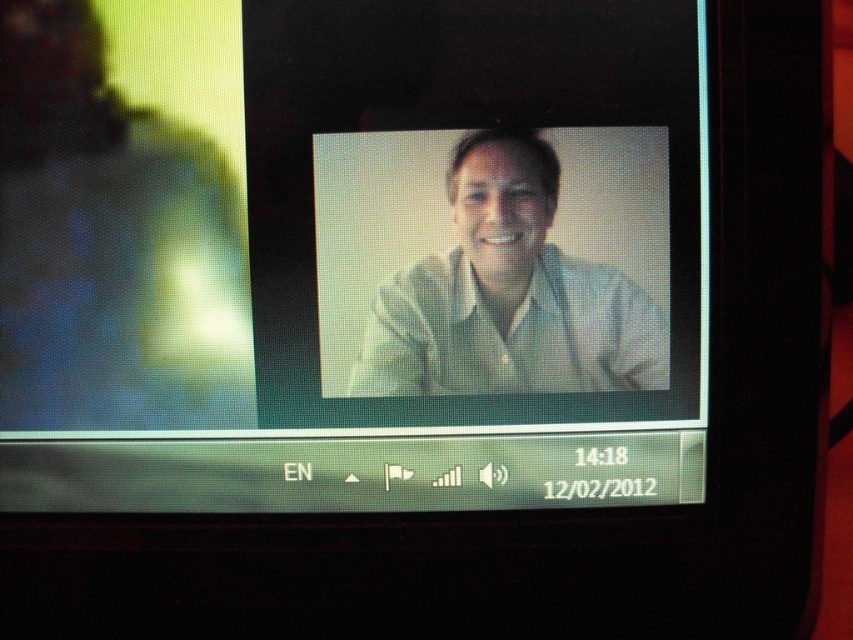
You are setting up a video call and need to adjust the camera angle so that both the matte white monitor at center and the white matte shirt at center are visible. Since the monitor is taller, where should you position the camera relative to the shirt?

The matte white monitor at center is taller than the white matte shirt at center, so you should position the camera slightly above the shirt to ensure both are fully visible in the frame.

You are trying to locate the matte white monitor at center on your screen. According to the coordinates provided, where exactly should you look?

The matte white monitor at center is located at point coordinates 0.409 on the x axis and 0.422 on the y axis.